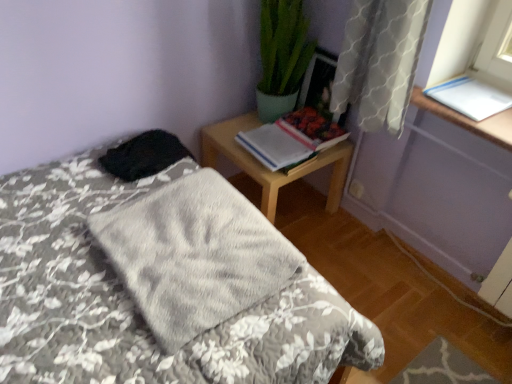
Question: Can you confirm if wooden nightstand at upper right is thinner than white paper at upper right, marked as the 3th book in a left-to-right arrangement?

Choices:
 (A) yes
 (B) no

Answer: (B)

Question: Is wooden nightstand at upper right shorter than white paper at upper right, placed as the first book when sorted from right to left?

Choices:
 (A) yes
 (B) no

Answer: (B)

Question: Is wooden nightstand at upper right further to the viewer compared to white paper at upper right, placed as the first book when sorted from right to left?

Choices:
 (A) yes
 (B) no

Answer: (A)

Question: Is wooden nightstand at upper right not within white paper at upper right, placed as the first book when sorted from right to left?

Choices:
 (A) no
 (B) yes

Answer: (B)

Question: Would you consider wooden nightstand at upper right to be distant from white paper at upper right, placed as the first book when sorted from right to left?

Choices:
 (A) yes
 (B) no

Answer: (B)

Question: Considering the positions of hardcover book at upper right, the 2th book in the right-to-left sequence, and wooden nightstand at upper right in the image, is hardcover book at upper right, the 2th book in the right-to-left sequence, taller or shorter than wooden nightstand at upper right?

Choices:
 (A) tall
 (B) short

Answer: (B)

Question: Looking at their shapes, would you say hardcover book at upper right, the 2th book in the right-to-left sequence, is wider or thinner than wooden nightstand at upper right?

Choices:
 (A) thin
 (B) wide

Answer: (A)

Question: From the image's perspective, is hardcover book at upper right, arranged as the second book when viewed from the left, positioned above or below wooden nightstand at upper right?

Choices:
 (A) above
 (B) below

Answer: (A)

Question: From a real-world perspective, is hardcover book at upper right, the 2th book in the right-to-left sequence, above or below wooden nightstand at upper right?

Choices:
 (A) above
 (B) below

Answer: (A)

Question: From a real-world perspective, relative to hardcover book at upper right, the first book in the left-to-right sequence, is wooden nightstand at upper right vertically above or below?

Choices:
 (A) above
 (B) below

Answer: (B)

Question: Is wooden nightstand at upper right inside the boundaries of hardcover book at upper right, the first book in the left-to-right sequence, or outside?

Choices:
 (A) outside
 (B) inside

Answer: (A)

Question: Visually, is wooden nightstand at upper right positioned to the left or to the right of hardcover book at upper right, arranged as the 3th book when viewed from the right?

Choices:
 (A) left
 (B) right

Answer: (B)

Question: Relative to hardcover book at upper right, the first book in the left-to-right sequence, is wooden nightstand at upper right in front or behind?

Choices:
 (A) front
 (B) behind

Answer: (B)

Question: Considering the positions of fluffy gray blanket at center and hardcover book at upper right, arranged as the second book when viewed from the left, in the image, is fluffy gray blanket at center bigger or smaller than hardcover book at upper right, arranged as the second book when viewed from the left,?

Choices:
 (A) big
 (B) small

Answer: (A)

Question: Is fluffy gray blanket at center in front of or behind hardcover book at upper right, the 2th book in the right-to-left sequence, in the image?

Choices:
 (A) front
 (B) behind

Answer: (A)